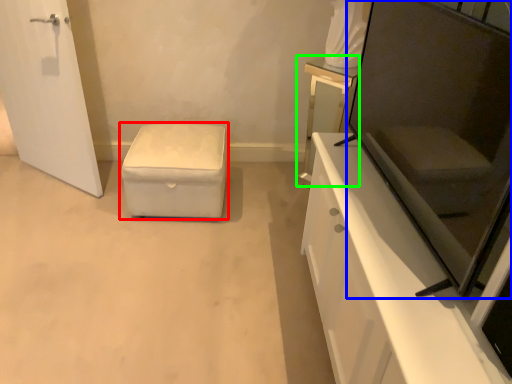
Question: Considering the real-world distances, which object is farthest from furniture (highlighted by a red box)? screen door (highlighted by a blue box) or vanity (highlighted by a green box)?

Choices:
 (A) screen door
 (B) vanity

Answer: (A)